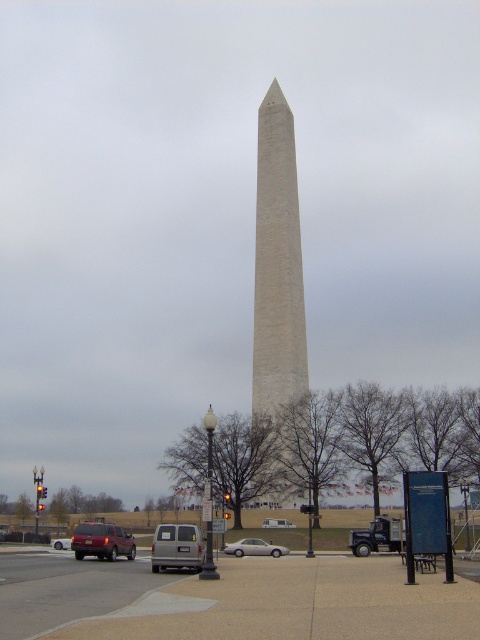
You are standing at the monument and want to take a photo of the matte maroon suv at lower left. Which direction should you face to capture it in your shot?

You should face towards the lower left direction to capture the matte maroon suv at lower left in your photo.

You are standing at the center of the image and want to find the point at coordinates (101, 541). Which vehicle should you look towards in the lower left area?

The point at coordinates (101, 541) is located on the matte maroon SUV at lower left.

You are a tourist standing at the monument and want to take a photo of both the matte maroon suv at lower left and the matte red suv at lower left. Which one should you pan your camera to the left to include in the frame?

To include both the matte maroon suv at lower left and the matte red suv at lower left in the frame, you should pan your camera to the left because the matte maroon suv at lower left is positioned to the right of the matte red suv at lower left. Panning left will capture the matte red suv at lower left first, then the matte maroon suv at lower left to its right.